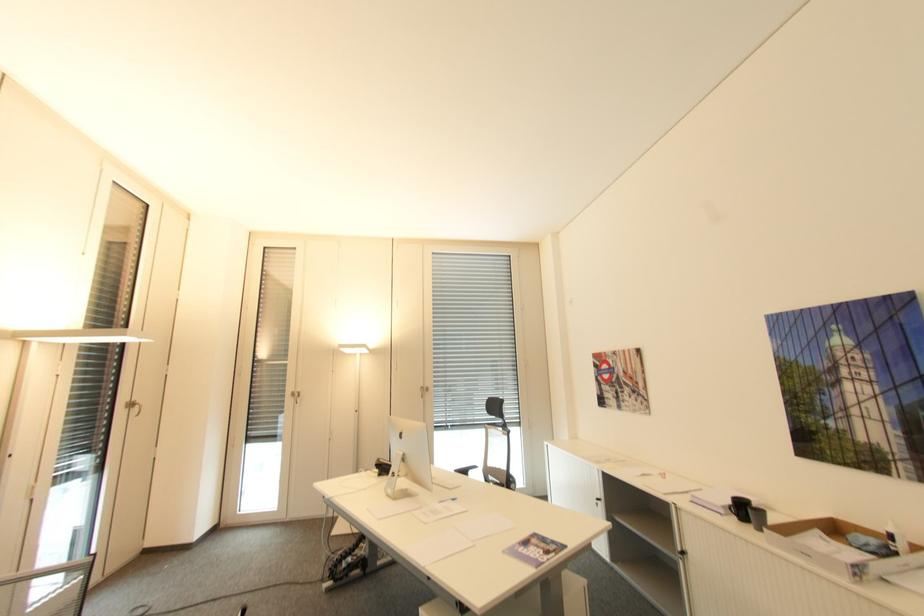
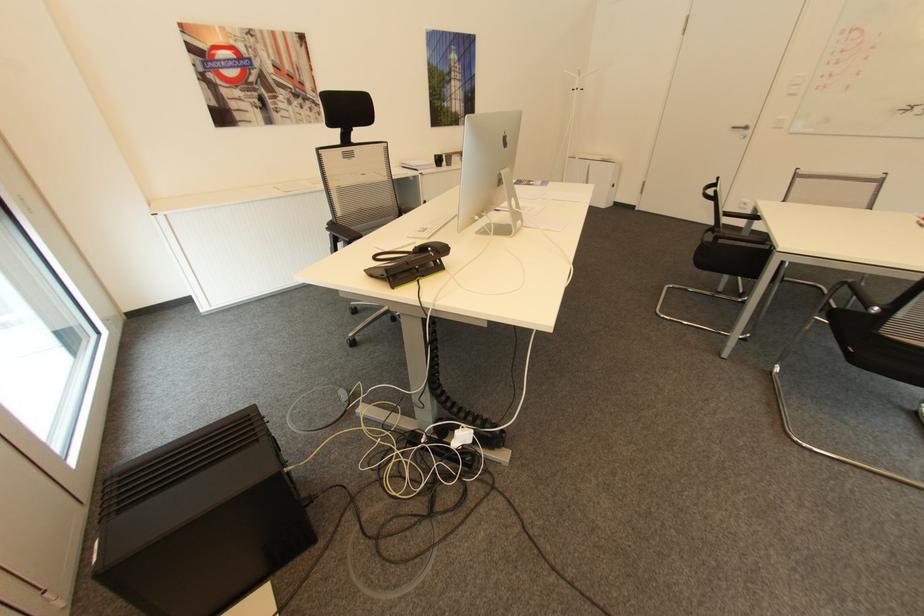
In the second image, find the point that corresponds to point (650, 397) in the first image.

(322, 102)